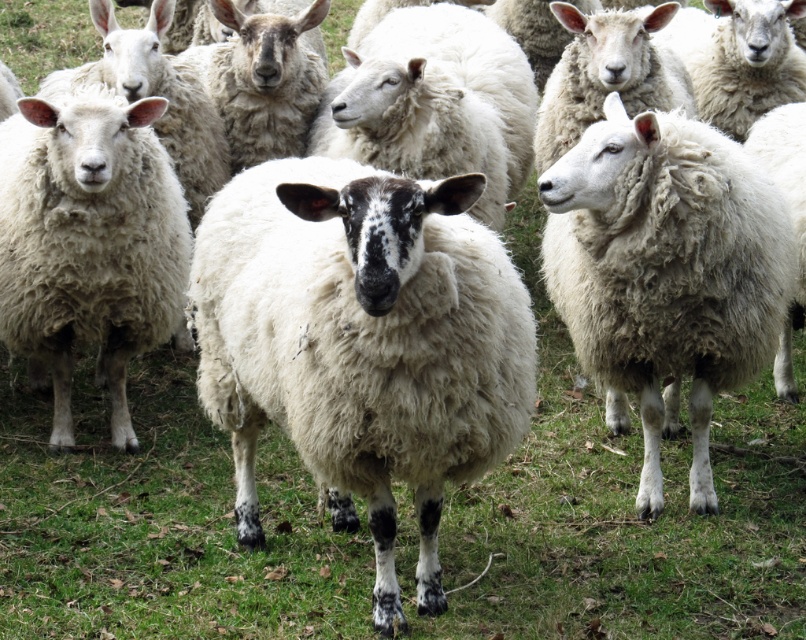
You are a farmer observing the sheep in the field. You notice two sheep, the white woolen sheep at center and the white woolly sheep at right. Which one is shorter in height?

The white woolen sheep at center is shorter in height compared to the white woolly sheep at right.

You are a shepherd trying to locate the white woolen sheep at center in the field. Based on their position coordinates, where exactly would you find it?

The white woolen sheep at center is located at point (360, 344).

You are a farmer checking your sheep in the field. You notice a specific location marked by a point at coordinates (360, 344). What animal is located at that point?

The point at (360, 344) marks a white woolen sheep at center.